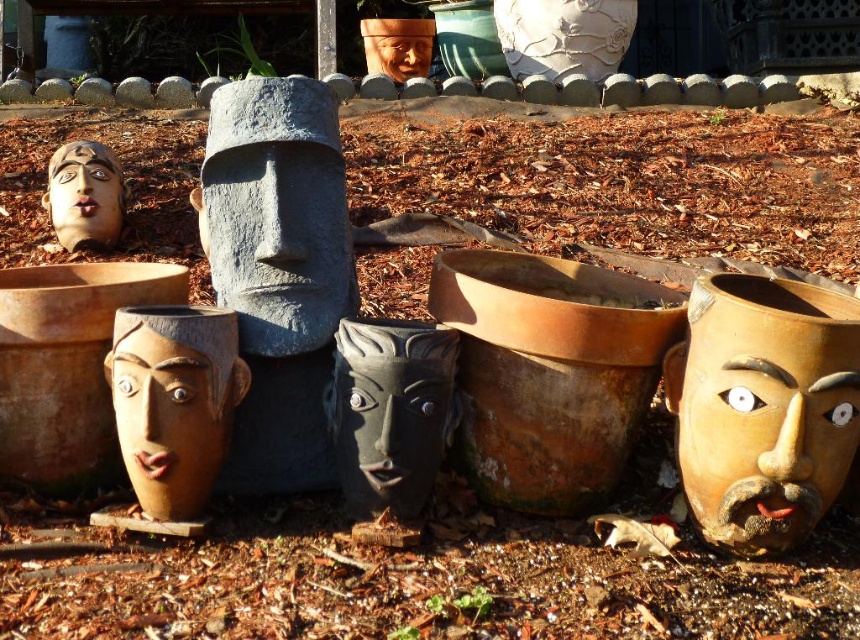
You are standing at the point marked by the coordinate point at (831, 360). You want to walk to the entrance of the garden, which is 6 feet away from your current position. Is the entrance located in the direction of the large smooth light colored pot on the low stone wall?

The entrance is 6 feet away from your current position at point (831, 360). The large smooth light colored pot is also 6.00 feet away from this point. Therefore, the entrance is likely in the direction of the large smooth light colored pot on the low stone wall.

You are a delivery person who needs to place a new package at the exact coordinates of the brown matte mask at right. What are the coordinates where you should place the package?

The coordinates for the brown matte mask at right are at point (x=763, y=406), so you should place the package there.

You are an art installer who needs to place a new sculpture between the gray stone statue at center and the black matte mask at center. Which object should the sculpture be placed closer to if it needs to be proportionally scaled to match their sizes?

The sculpture should be placed closer to the black matte mask at center because the gray stone statue at center is larger in size than the black matte mask at center, so the sculpture needs to be closer to the smaller object to maintain proportional scaling.